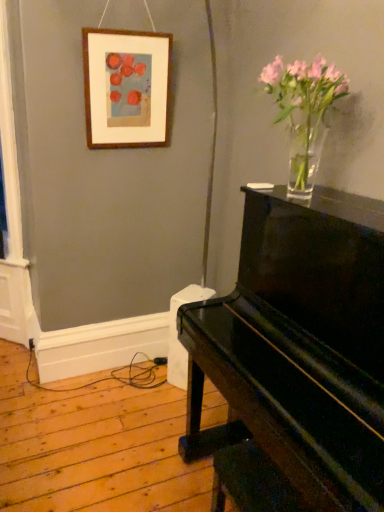
Image resolution: width=384 pixels, height=512 pixels. Identify the location of free space above wooden picture frame at upper left (from a real-world perspective). (125, 31).